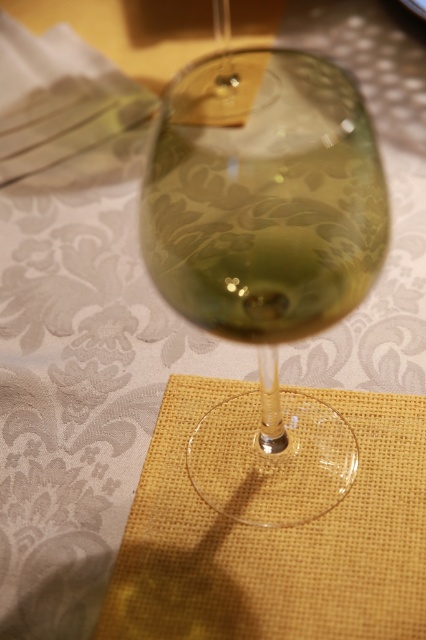
You are setting up a table for a dinner party and need to ensure that the transparent glass at center won not tip over. Considering the burlap placemat at center, which object is taller and might affect stability?

The transparent glass at center is taller than the burlap placemat at center, so the glass might be more prone to tipping over due to its height.

You are a bartender preparing a drink and need to choose between the transparent glass at center and the burlap placemat at center. Which item is thinner?

The transparent glass at center is thinner than the burlap placemat at center according to the description.

You are arranging a table for a dinner party and need to place the transparent glass at center and the burlap placemat at center. According to the image, which object should be placed on the left side to ensure proper alignment?

The transparent glass at center should be placed on the left side because it is to the left of the burlap placemat at center in the image.